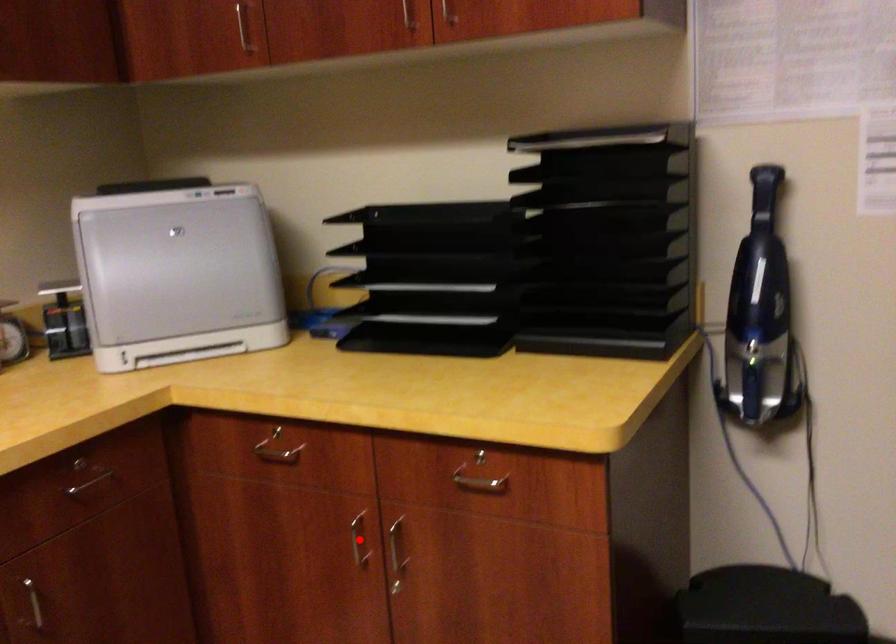
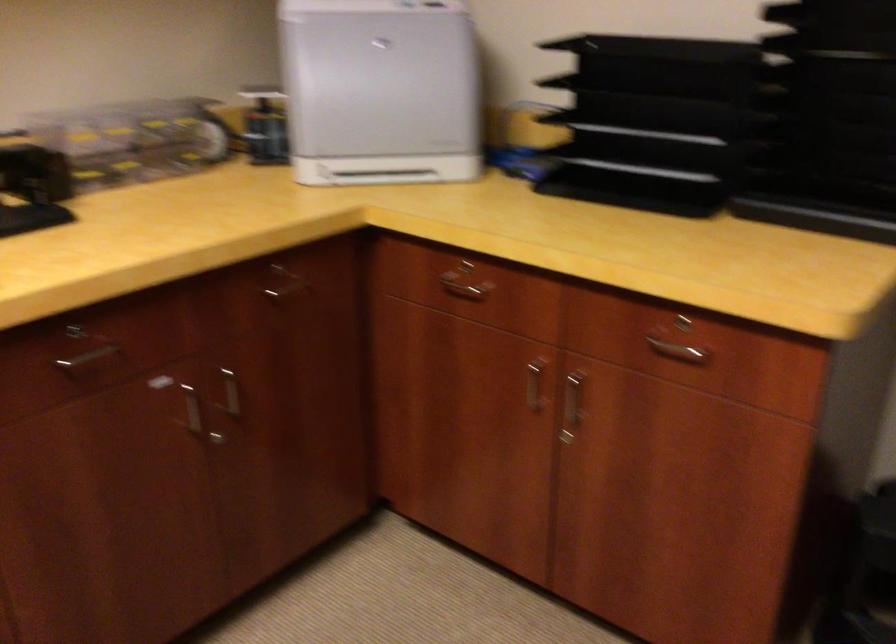
Where in the second image is the point corresponding to the highlighted location from the first image?

(533, 386)